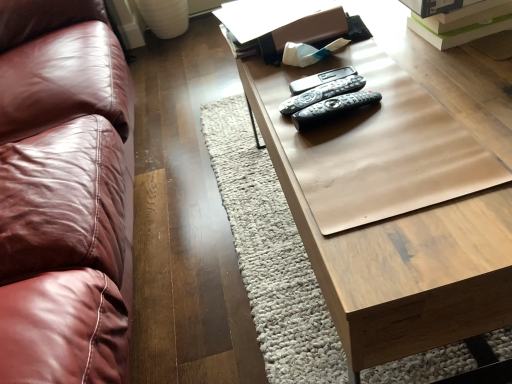
Locate an element on the screen. The width and height of the screenshot is (512, 384). vacant space to the left of black plastic remotes at center, which appears as the first remote when viewed from the front is located at coordinates (288, 137).